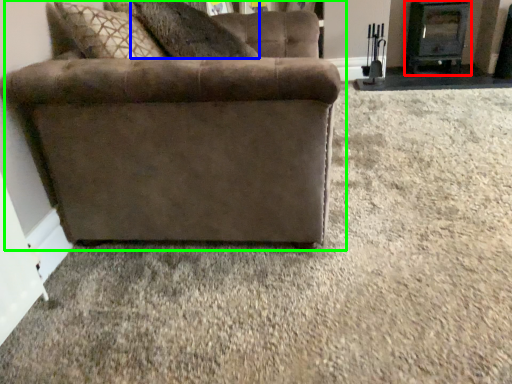
Question: Considering the real-world distances, which object is closest to fireplace (highlighted by a red box)? pillow (highlighted by a blue box) or studio couch (highlighted by a green box).

Choices:
 (A) pillow
 (B) studio couch

Answer: (A)